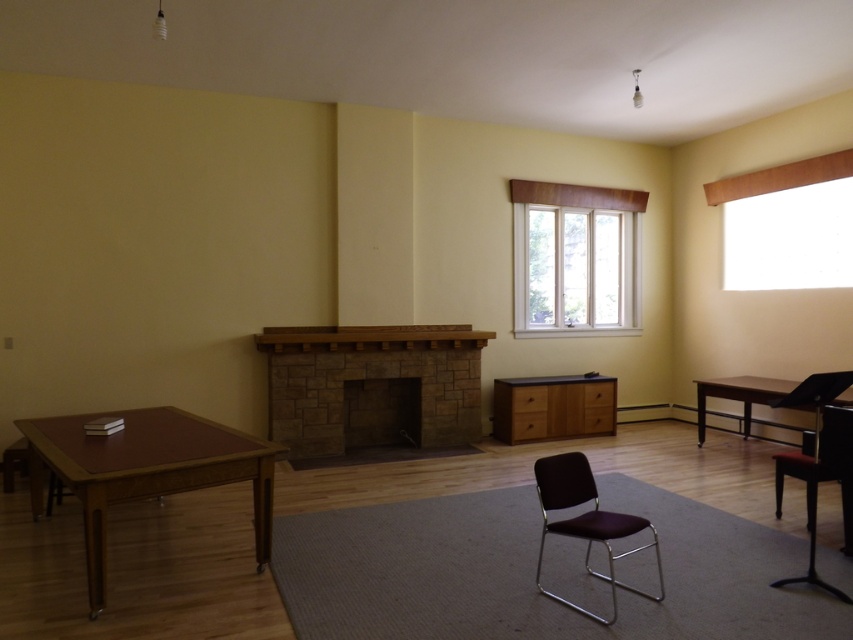
Which is more to the right, brown wood table at left or white wood window at center?

white wood window at center is more to the right.

Who is higher up, brown wood table at left or white wood window at center?

white wood window at center is above.

Find the location of a particular element. The width and height of the screenshot is (853, 640). brown wood table at left is located at coordinates (144, 470).

Between purple vinyl swivel chair at center and brown wooden table at right, which one is positioned lower?

purple vinyl swivel chair at center is lower down.

Who is more forward, (593, 497) or (808, 404)?

Point (593, 497) is more forward.

At what (x,y) coordinates should I click in order to perform the action: click on purple vinyl swivel chair at center. Please return your answer as a coordinate pair (x, y). Image resolution: width=853 pixels, height=640 pixels. Looking at the image, I should click on (585, 522).

From the picture: Is brown wood table at left shorter than brown wooden table at right?

No, brown wood table at left is not shorter than brown wooden table at right.

Who is positioned more to the left, brown wood table at left or brown wooden table at right?

From the viewer's perspective, brown wood table at left appears more on the left side.

Between point (70, 484) and point (701, 392), which one is positioned behind?

The point (701, 392) is behind.

In order to click on brown wood table at left in this screenshot , I will do `click(144, 470)`.